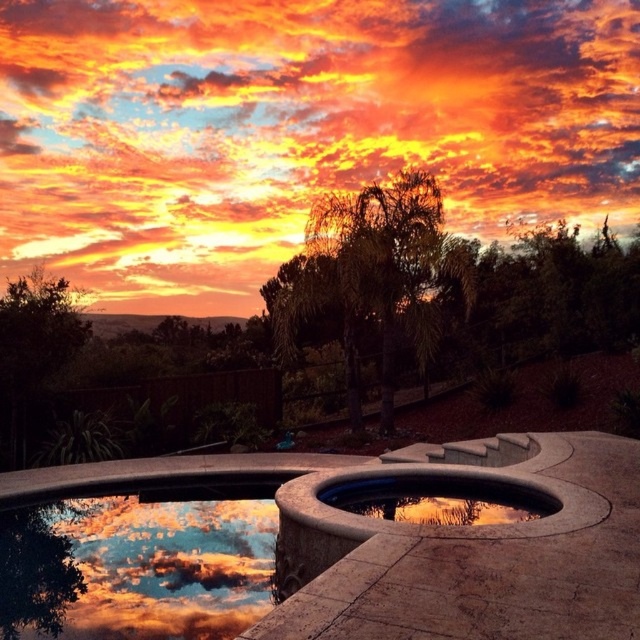
Question: Is orange cotton cloud at upper center further to the viewer compared to smooth concrete pool at center?

Choices:
 (A) no
 (B) yes

Answer: (B)

Question: Which point appears closest to the camera in this image?

Choices:
 (A) (436, 509)
 (B) (259, 72)

Answer: (A)

Question: Does orange cotton cloud at upper center come in front of smooth concrete pool at center?

Choices:
 (A) no
 (B) yes

Answer: (A)

Question: Is orange cotton cloud at upper center smaller than smooth concrete pool at center?

Choices:
 (A) no
 (B) yes

Answer: (A)

Question: Among these objects, which one is nearest to the camera?

Choices:
 (A) orange cotton cloud at upper center
 (B) smooth concrete pool at center

Answer: (B)